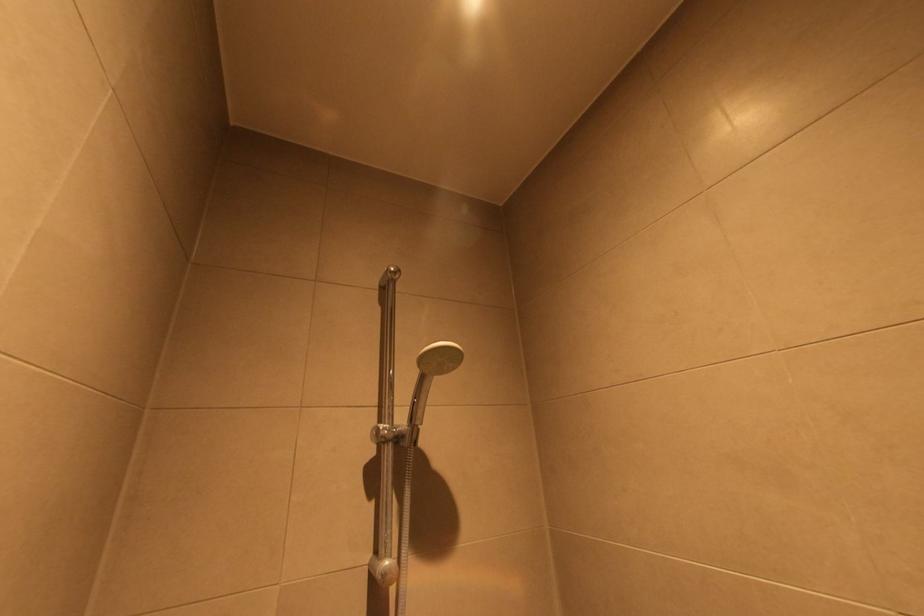
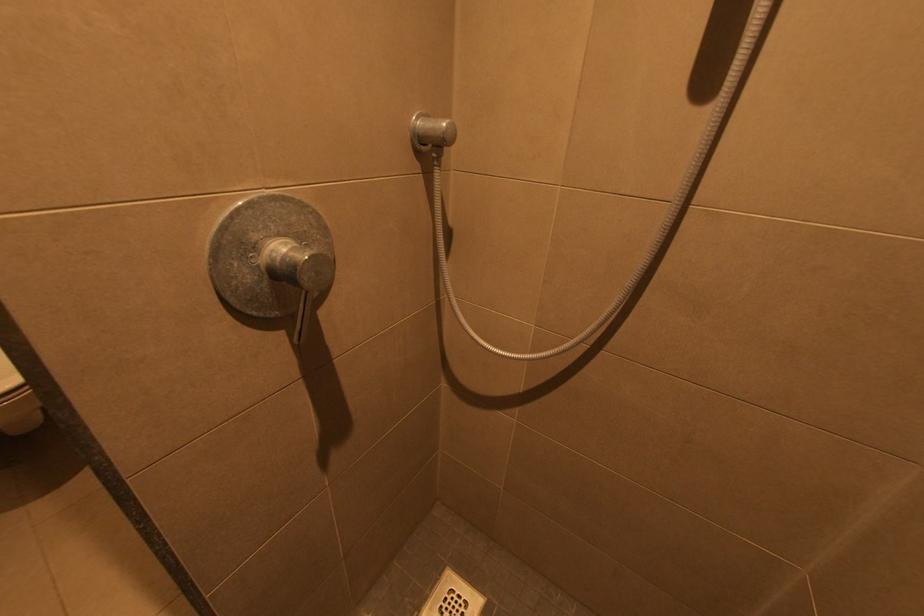
The first image is from the beginning of the video and the second image is from the end. How did the camera likely rotate when shooting the video?

The rotation direction of the camera is left-down.